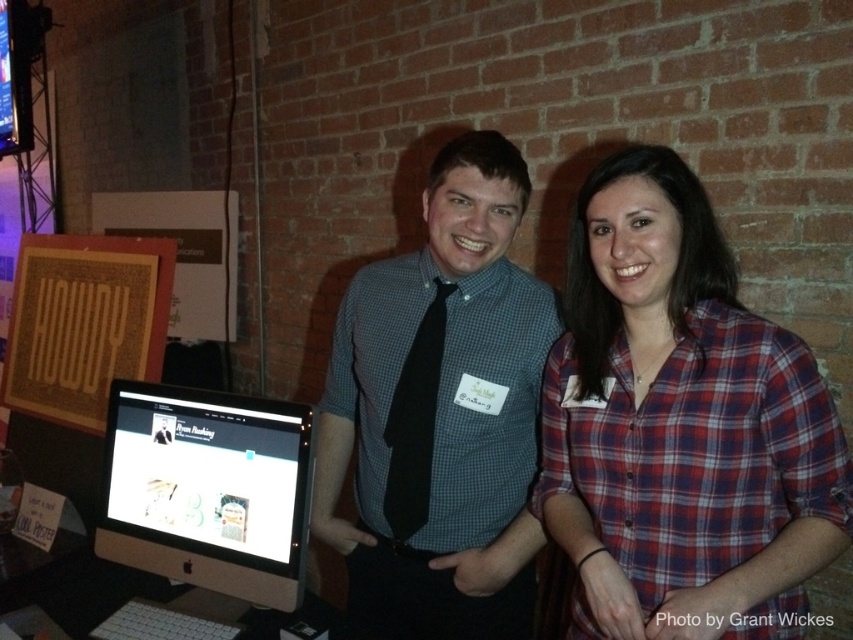
You are an event organizer who needs to arrange name tags for attendees. The plaid cotton shirt at center and checkered fabric shirt at center are both in front of a computer monitor. Which attendee should you place the taller name tag on to ensure it doesn

The checkered fabric shirt at center is taller than the plaid cotton shirt at center, so the taller name tag should be placed on the checkered fabric shirt at center to ensure visibility.

You are organizing a photo shoot and need to ensure that all subjects are visible in the frame. Given that the checkered fabric shirt at center and the satin black monitor at center are both in the shot, which object will appear bigger in the photo?

The checkered fabric shirt at center will appear bigger in the photo because it has a larger size compared to the satin black monitor at center.